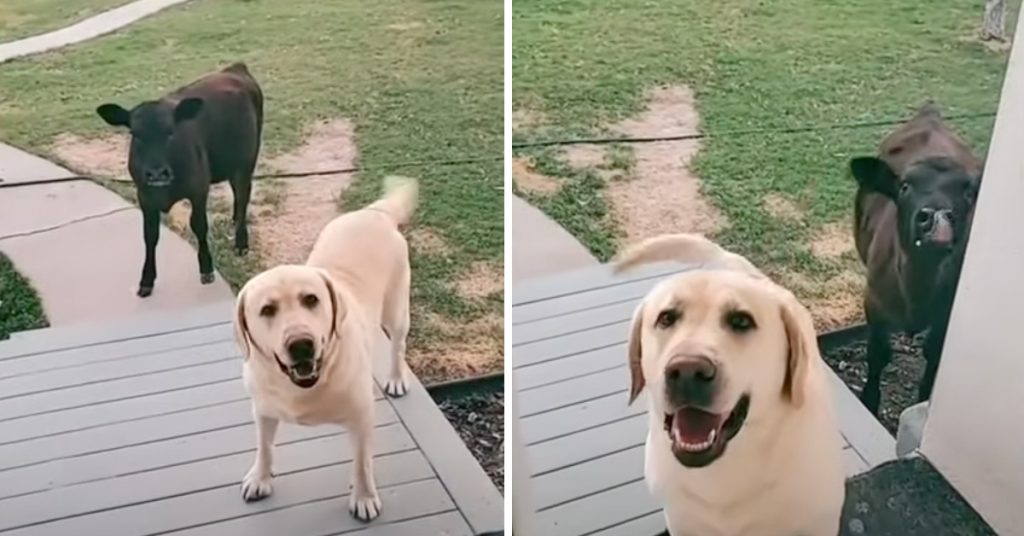
Identify the location of white house square pillar. The width and height of the screenshot is (1024, 536). (988, 345).